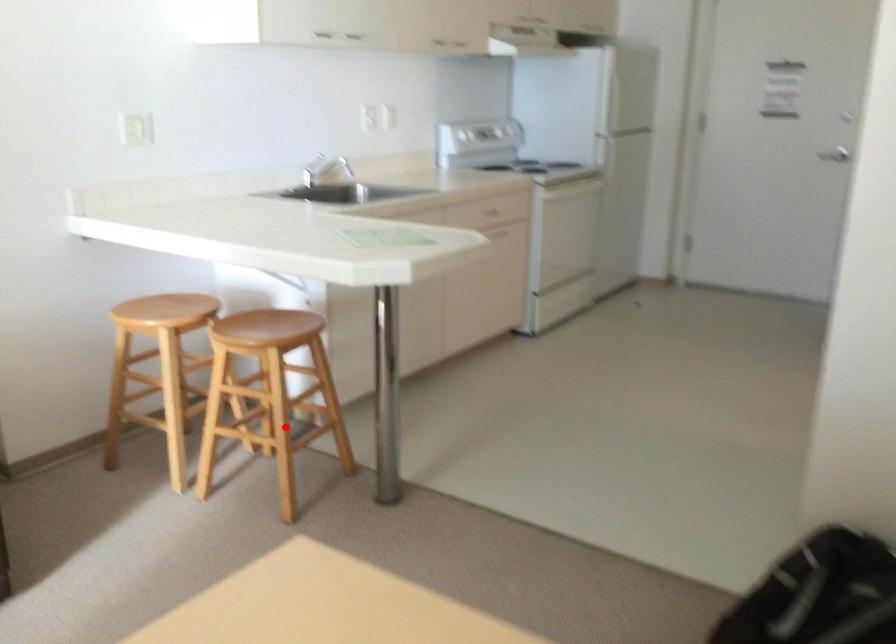
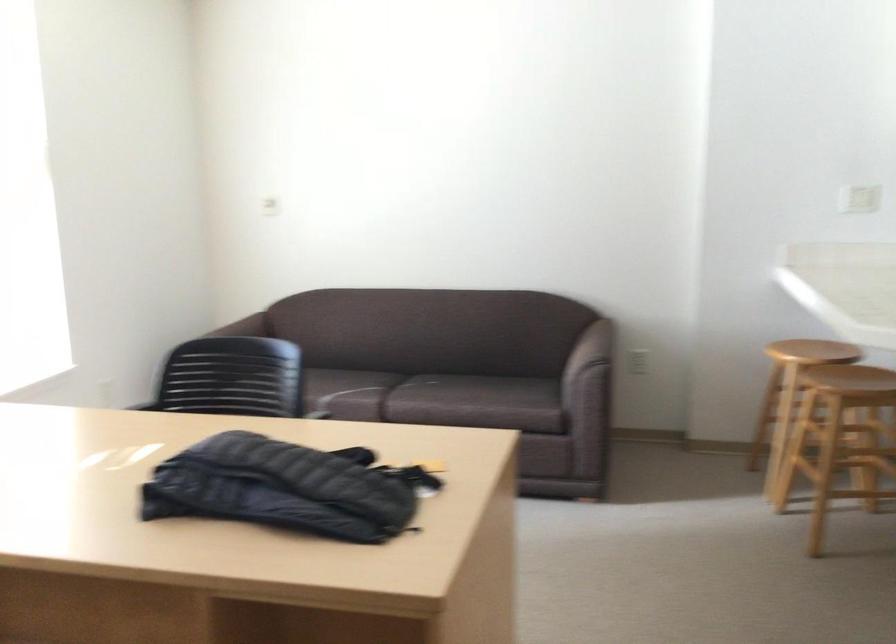
In the second image, find the point that corresponds to the highlighted location in the first image.

(837, 466)